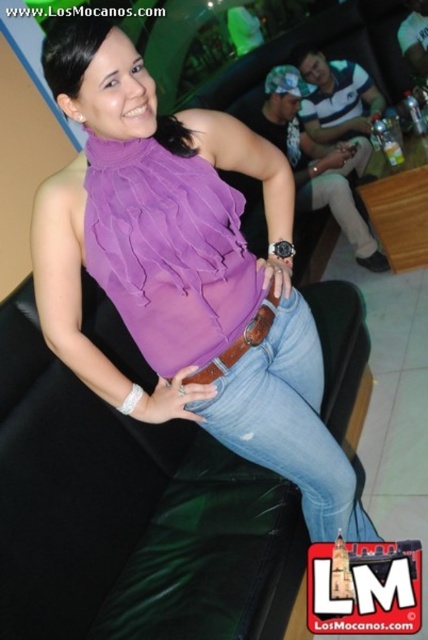
Based on the scene description, can you determine the spatial relationship between the purple chiffon blouse at center and the jeans at center?

The purple chiffon blouse at center is located above the jeans at center.

Based on the scene description, where is the jeans at center located in terms of coordinates?

The jeans at center is located at coordinates point (288, 422).

You are standing at the origin point of the image coordinate system. You want to walk to the point labeled as point (155, 337). However, there is an obstacle at point (297, 401). Will you encounter the obstacle before reaching your destination?

Since point (155, 337) is in front of point (297, 401), you will reach your destination before encountering the obstacle at point (297, 401).